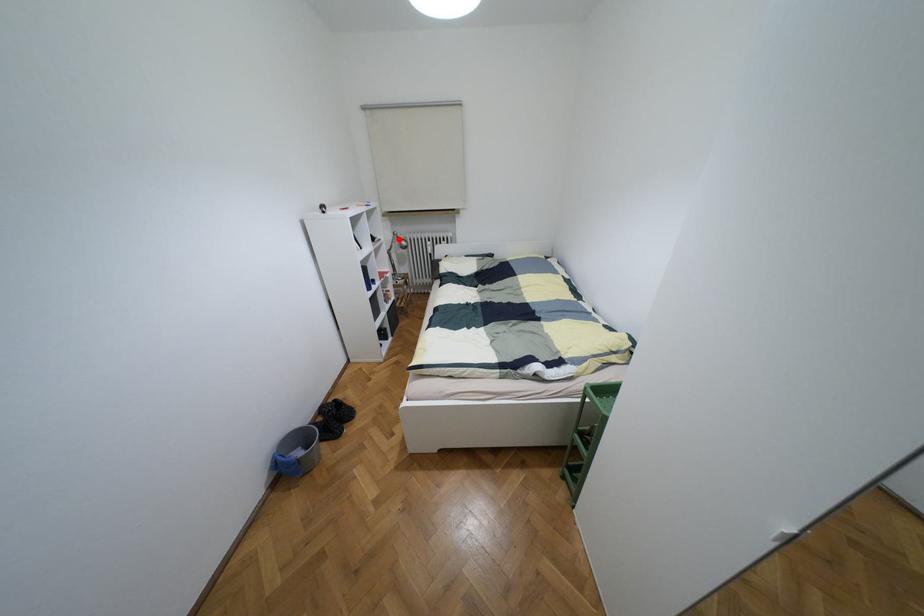
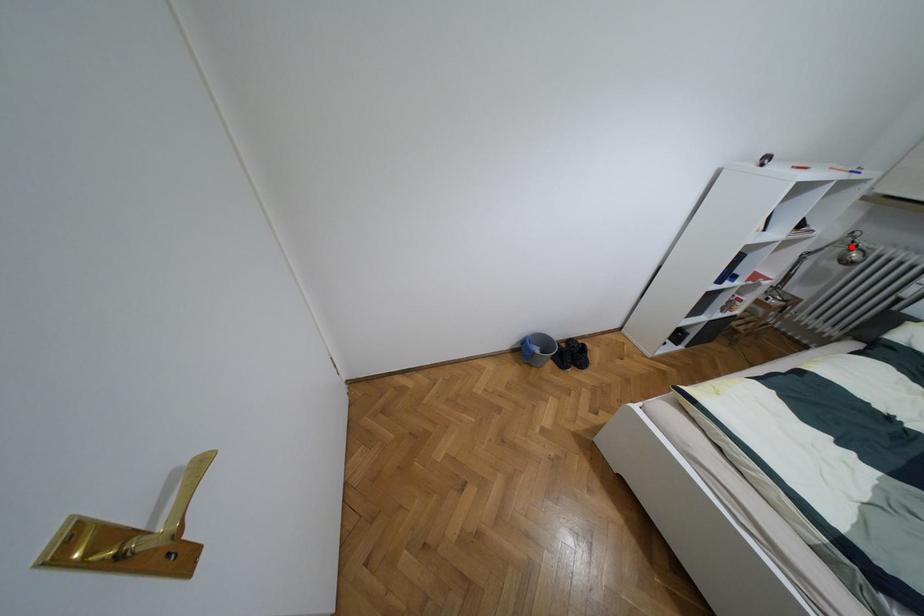
I am providing you with two images of the same scene from different viewpoints. A red point is marked on the first image and another point is marked on the second image. Is the red point in image1 aligned with the point shown in image2?

Yes